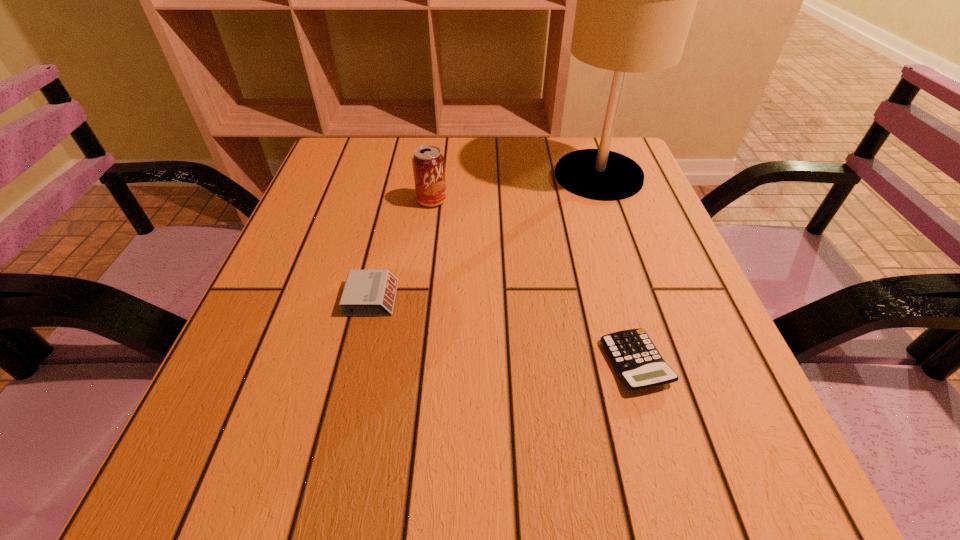
This screenshot has height=540, width=960. Identify the location of free space between the nearest object and the second object from left to right. (534, 281).

This screenshot has height=540, width=960. I want to click on vacant region between the third shortest object and the tallest object, so click(x=516, y=188).

Identify which object is the second nearest to the leftmost object. Please provide its 2D coordinates. Your answer should be formatted as a tuple, i.e. [(x, y)], where the tuple contains the x and y coordinates of a point satisfying the conditions above.

[(637, 361)]

Locate which object ranks second in proximity to the second tallest object. Please provide its 2D coordinates. Your answer should be formatted as a tuple, i.e. [(x, y)], where the tuple contains the x and y coordinates of a point satisfying the conditions above.

[(635, 0)]

In order to click on free space in the image that satisfies the following two spatial constraints: 1. on the back side of the alarm clock; 2. on the right side of the third object from right to left in this screenshot , I will do `click(395, 200)`.

At what (x,y) coordinates should I click in order to perform the action: click on vacant region that satisfies the following two spatial constraints: 1. on the back side of the second tallest object; 2. on the right side of the tallest object. Please return your answer as a coordinate pair (x, y). This screenshot has height=540, width=960. Looking at the image, I should click on (435, 176).

Identify the location of vacant space that satisfies the following two spatial constraints: 1. on the back side of the tallest object; 2. on the right side of the second nearest object. Image resolution: width=960 pixels, height=540 pixels. (400, 176).